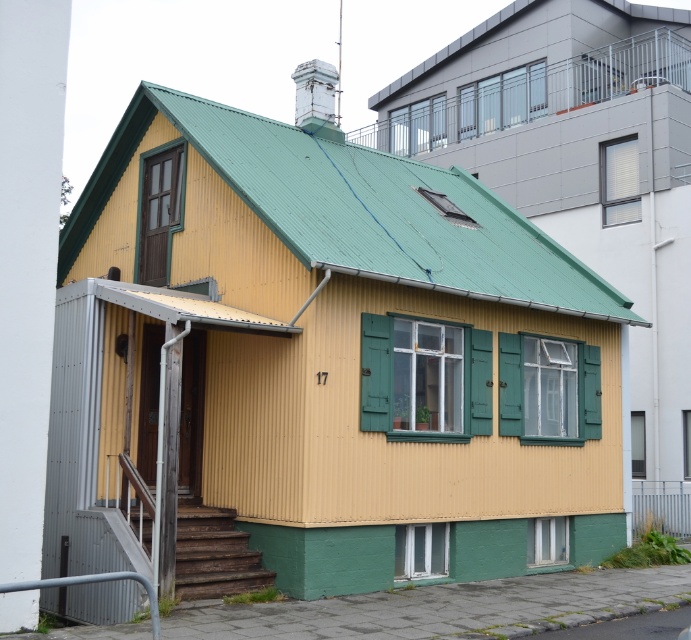
Which is above, green wood door at upper left or green wooden shutter at upper right?

green wooden shutter at upper right is above.

Does point (178, 170) lie in front of point (605, 163)?

Yes, it is in front of point (605, 163).

Measure the distance between point (144, 205) and camera.

16.91 meters

Where is `green wood door at upper left`? green wood door at upper left is located at coordinates (158, 211).